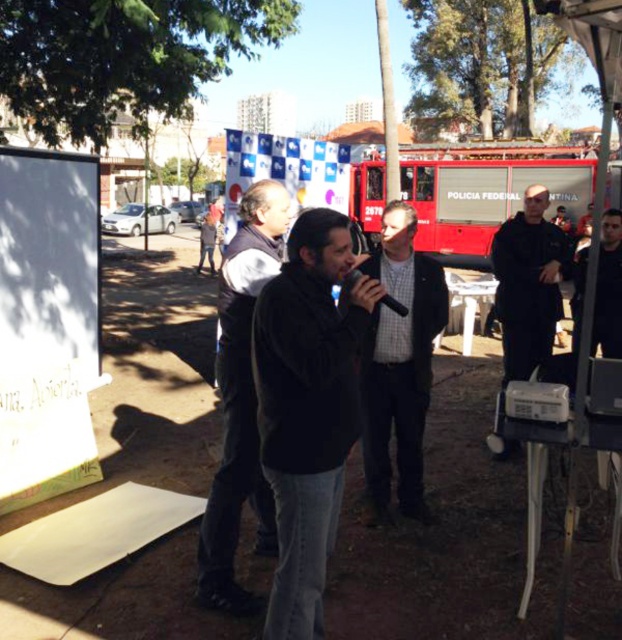
Question: Is dark gray sweater at center to the right of dark gray jacket at center from the viewer's perspective?

Choices:
 (A) no
 (B) yes

Answer: (A)

Question: Is black softshell jacket at center to the left of dark gray jacket at center from the viewer's perspective?

Choices:
 (A) yes
 (B) no

Answer: (A)

Question: Estimate the real-world distances between objects in this image. Which object is farther from the dark gray sweater at center?

Choices:
 (A) dark blue uniform at center
 (B) red matte truck at center

Answer: (B)

Question: Among these points, which one is nearest to the camera?

Choices:
 (A) (572, 184)
 (B) (541, 216)

Answer: (B)

Question: Is black softshell jacket at center below dark gray jacket at center?

Choices:
 (A) no
 (B) yes

Answer: (B)

Question: Which object is the closest to the black softshell jacket at center?

Choices:
 (A) dark gray sweater at center
 (B) red matte truck at center

Answer: (A)